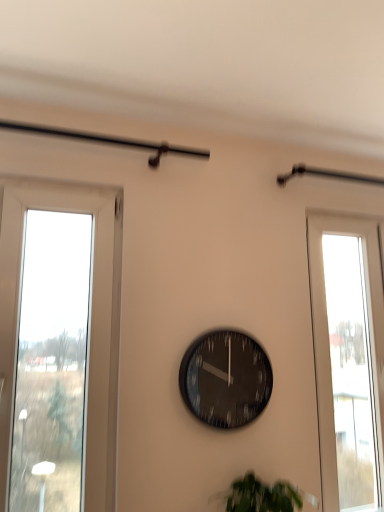
Question: Can you confirm if green leafy plant at lower center is positioned to the right of black glass clock at center?

Choices:
 (A) no
 (B) yes

Answer: (B)

Question: Are green leafy plant at lower center and black glass clock at center located far from each other?

Choices:
 (A) no
 (B) yes

Answer: (A)

Question: Is green leafy plant at lower center oriented away from black glass clock at center?

Choices:
 (A) no
 (B) yes

Answer: (A)

Question: Is green leafy plant at lower center located outside black glass clock at center?

Choices:
 (A) yes
 (B) no

Answer: (A)

Question: Could black glass clock at center be considered to be inside green leafy plant at lower center?

Choices:
 (A) no
 (B) yes

Answer: (A)

Question: Are green leafy plant at lower center and black glass clock at center making contact?

Choices:
 (A) no
 (B) yes

Answer: (A)

Question: From the image's perspective, would you say transparent glass window at right is positioned over black glass clock at center?

Choices:
 (A) yes
 (B) no

Answer: (A)

Question: Considering the relative sizes of transparent glass window at right and black glass clock at center in the image provided, is transparent glass window at right smaller than black glass clock at center?

Choices:
 (A) yes
 (B) no

Answer: (B)

Question: From a real-world perspective, is transparent glass window at right beneath black glass clock at center?

Choices:
 (A) no
 (B) yes

Answer: (A)

Question: Considering the relative sizes of transparent glass window at right and black glass clock at center in the image provided, is transparent glass window at right shorter than black glass clock at center?

Choices:
 (A) no
 (B) yes

Answer: (A)

Question: Is transparent glass window at right positioned far away from black glass clock at center?

Choices:
 (A) no
 (B) yes

Answer: (A)

Question: Would you say transparent glass window at right is outside black glass clock at center?

Choices:
 (A) no
 (B) yes

Answer: (B)

Question: Considering the relative positions of black glass clock at center and green leafy plant at lower center in the image provided, is black glass clock at center to the left of green leafy plant at lower center from the viewer's perspective?

Choices:
 (A) no
 (B) yes

Answer: (B)